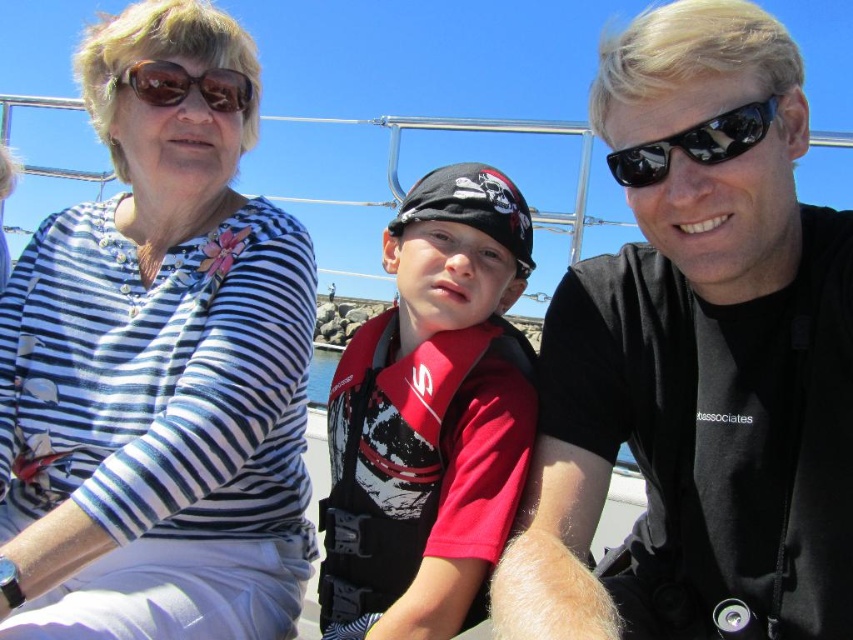
Based on the scene description, can you determine the spatial relationship between the red life vest at center and the brown reflective sunglasses at upper left?

The red life vest at center is located below the brown reflective sunglasses at upper left.

You are standing on a dock and see two objects in the water. The first is a black matte shirt at center and the second is a red life vest on the boy. Which one is closer to you?

The black matte shirt at center is closer to you because they are 14.87 meters apart.